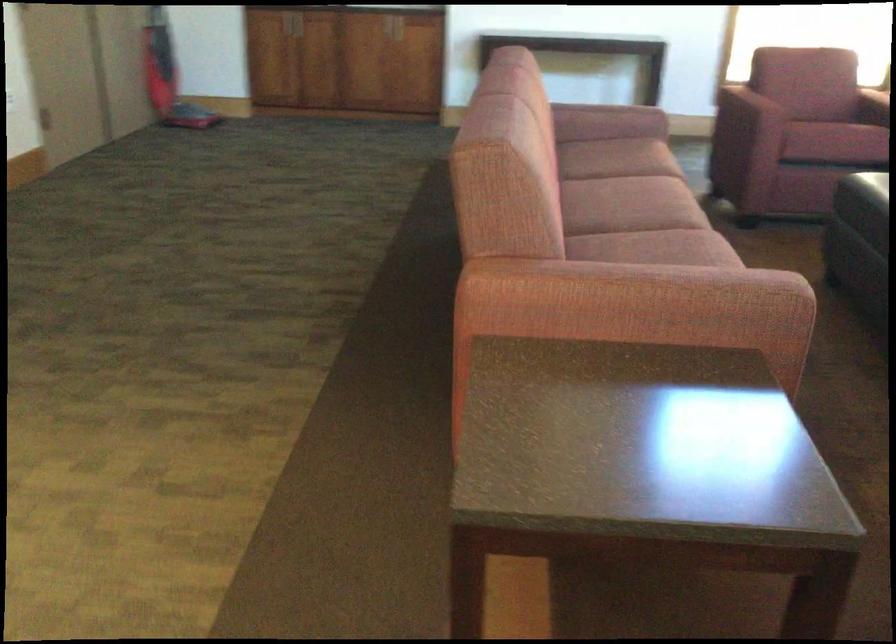
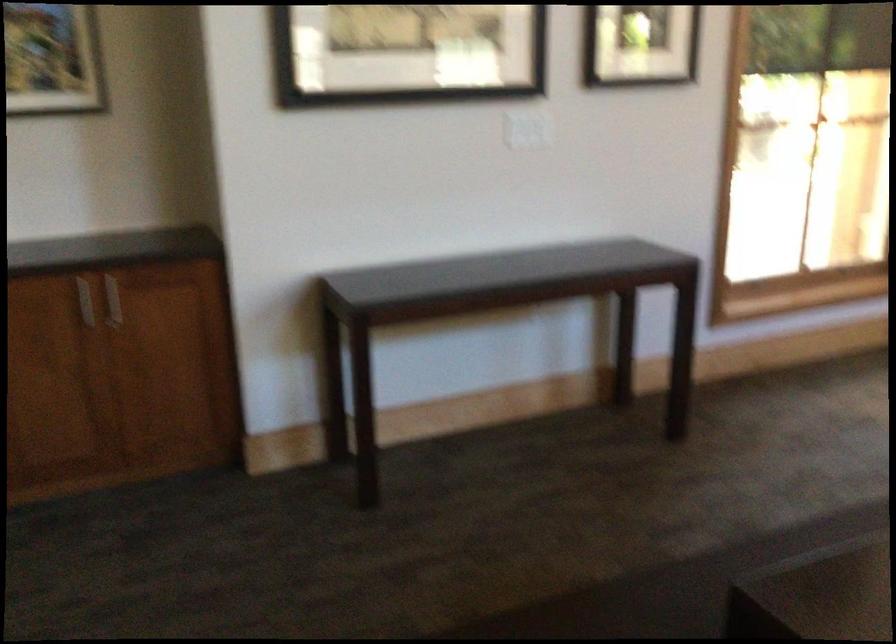
Question: What movement of the cameraman would produce the second image?

Choices:
 (A) Left
 (B) Right
 (C) Forward
 (D) Backward

Answer: (C)